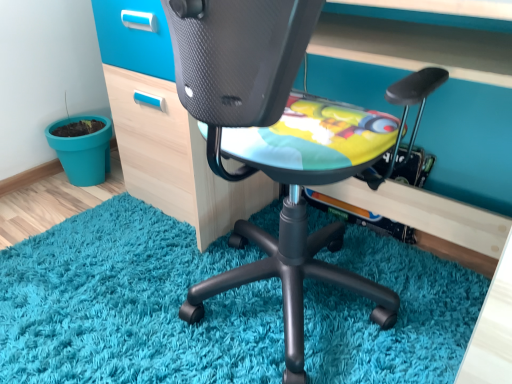
Question: Is the surface of teal plastic flowerpot at lower left in direct contact with matte black chair at center?

Choices:
 (A) yes
 (B) no

Answer: (B)

Question: Is teal plastic flowerpot at lower left to the right of matte black chair at center from the viewer's perspective?

Choices:
 (A) no
 (B) yes

Answer: (A)

Question: Can you confirm if teal plastic flowerpot at lower left is wider than matte black chair at center?

Choices:
 (A) no
 (B) yes

Answer: (A)

Question: Is teal plastic flowerpot at lower left positioned with its back to matte black chair at center?

Choices:
 (A) no
 (B) yes

Answer: (A)

Question: From a real-world perspective, is teal plastic flowerpot at lower left physically above matte black chair at center?

Choices:
 (A) yes
 (B) no

Answer: (B)

Question: Are teal plastic flowerpot at lower left and matte black chair at center located far from each other?

Choices:
 (A) no
 (B) yes

Answer: (B)

Question: Is matte black chair at center placed right next to teal plastic flowerpot at lower left?

Choices:
 (A) no
 (B) yes

Answer: (A)

Question: Is matte black chair at center positioned in front of teal plastic flowerpot at lower left?

Choices:
 (A) yes
 (B) no

Answer: (A)

Question: Could you tell me if matte black chair at center is facing teal plastic flowerpot at lower left?

Choices:
 (A) yes
 (B) no

Answer: (B)

Question: From a real-world perspective, is matte black chair at center beneath teal plastic flowerpot at lower left?

Choices:
 (A) no
 (B) yes

Answer: (A)

Question: Considering the relative sizes of matte black chair at center and teal plastic flowerpot at lower left in the image provided, is matte black chair at center thinner than teal plastic flowerpot at lower left?

Choices:
 (A) yes
 (B) no

Answer: (B)

Question: Can you confirm if matte black chair at center is taller than teal plastic flowerpot at lower left?

Choices:
 (A) no
 (B) yes

Answer: (B)

Question: In the image, is matte black chair at center positioned in front of or behind teal plastic flowerpot at lower left?

Choices:
 (A) behind
 (B) front

Answer: (B)